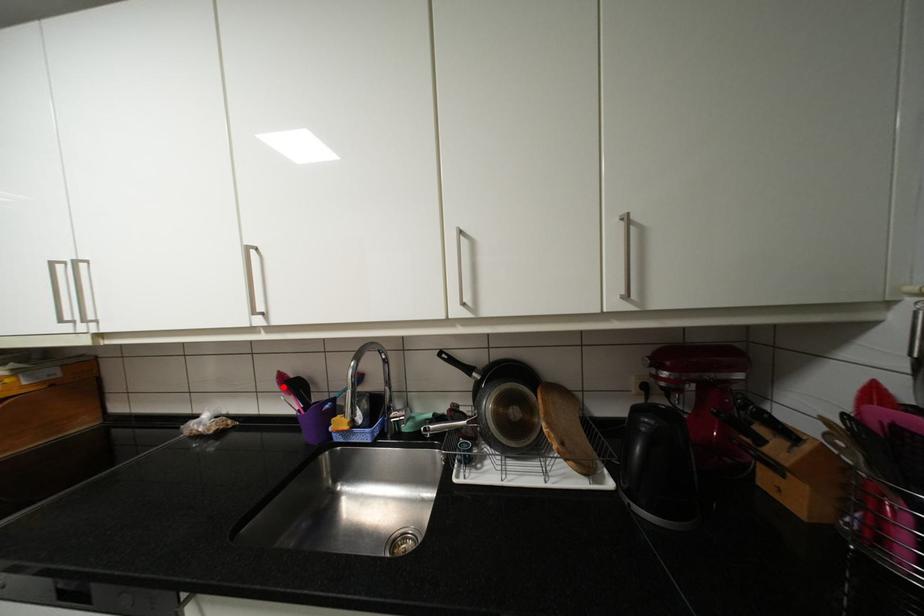
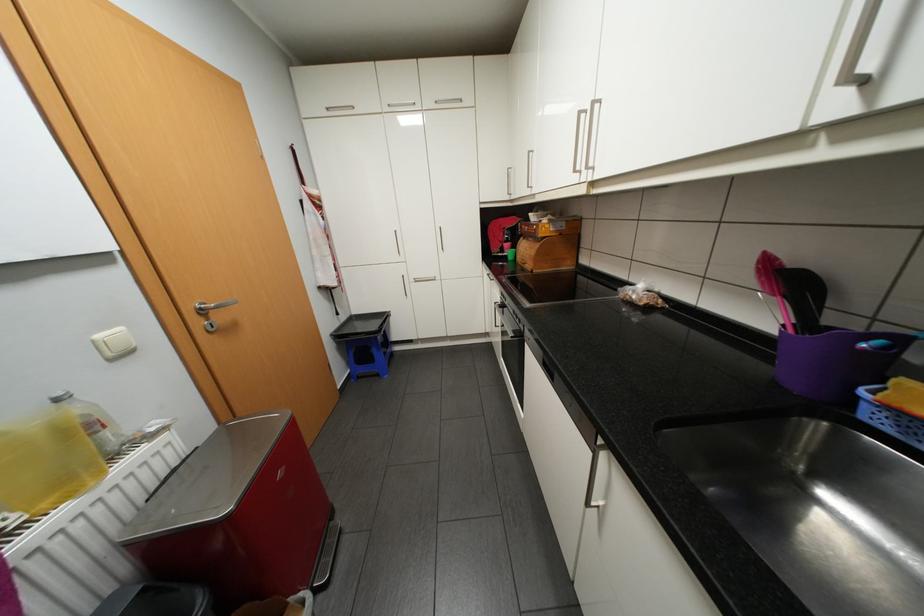
Where in the second image is the point corresponding to the highlighted location from the first image?

(756, 276)